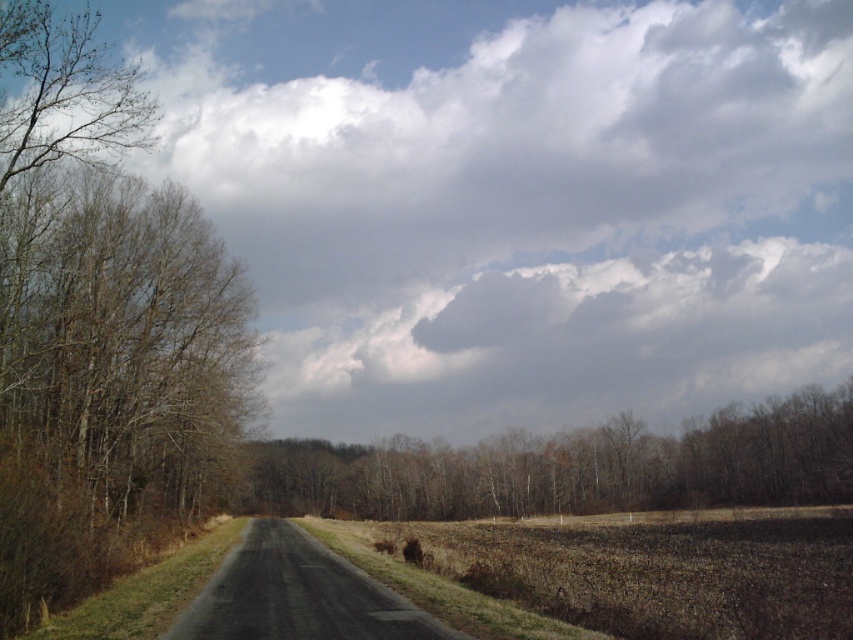
Is point (660, 209) positioned in front of point (166, 454)?

No, it is not.

Is cloudy sky at upper center wider than brown leafless tree at left?

Yes, cloudy sky at upper center is wider than brown leafless tree at left.

Where is `cloudy sky at upper center`? The height and width of the screenshot is (640, 853). cloudy sky at upper center is located at coordinates (517, 200).

Does point (677, 177) come behind point (659, 493)?

Yes, point (677, 177) is behind point (659, 493).

Is point (799, 128) less distant than point (248, 502)?

No, it is behind (248, 502).

Does point (585, 19) lie behind point (367, 477)?

Yes, it is.

Image resolution: width=853 pixels, height=640 pixels. In order to click on cloudy sky at upper center in this screenshot , I will do `click(517, 200)`.

Consider the image. Between brown leafless tree at left and brown/dry wood trees at center, which one is positioned lower?

brown/dry wood trees at center

Does brown leafless tree at left have a lesser height compared to brown/dry wood trees at center?

Incorrect, brown leafless tree at left's height does not fall short of brown/dry wood trees at center's.

In order to click on brown leafless tree at left in this screenshot , I will do `click(102, 326)`.